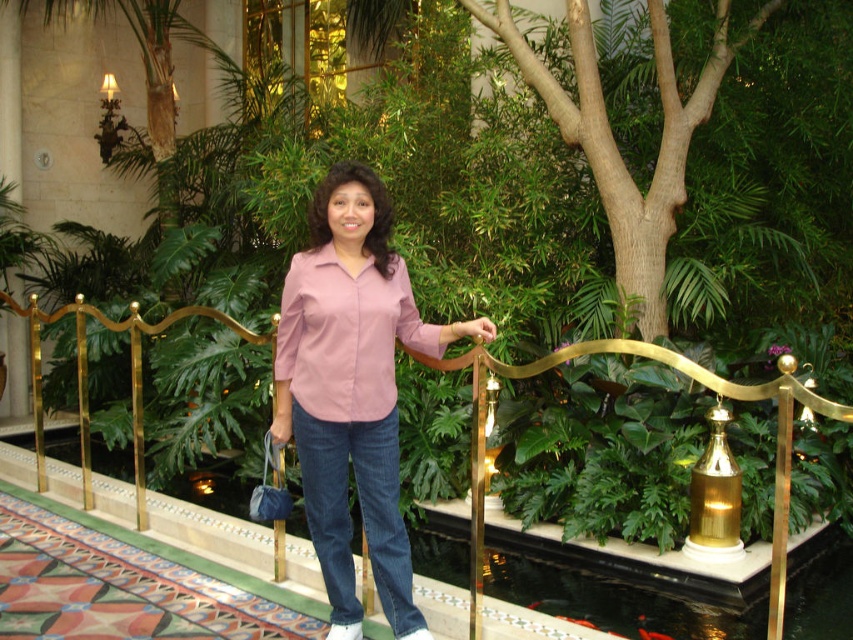
Question: Is the position of pink satin blouse at center more distant than that of gold metallic rail at center?

Choices:
 (A) yes
 (B) no

Answer: (A)

Question: Is pink satin blouse at center positioned at the back of gold metallic rail at center?

Choices:
 (A) yes
 (B) no

Answer: (A)

Question: From the image, what is the correct spatial relationship of pink satin blouse at center in relation to gold metallic rail at center?

Choices:
 (A) above
 (B) below

Answer: (A)